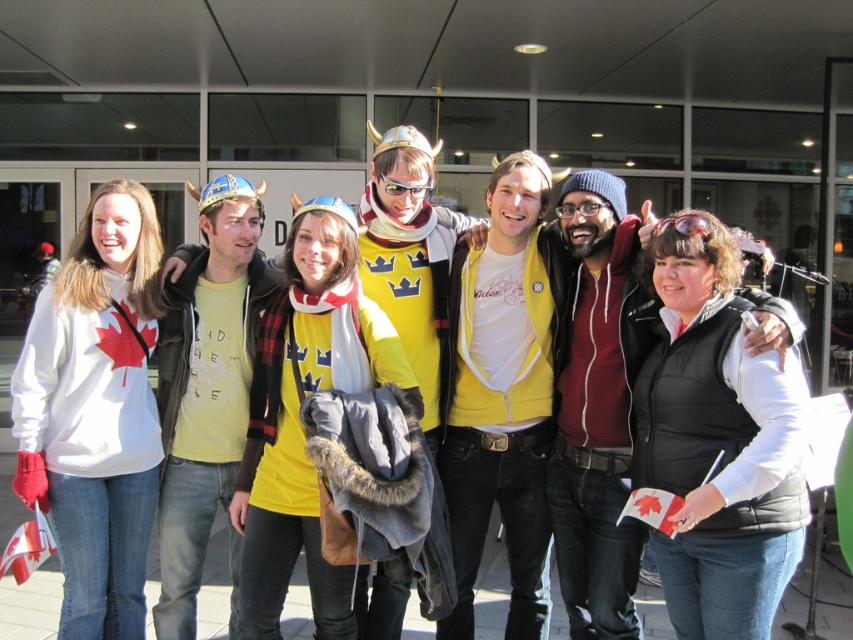
Question: Which point is closer to the camera?

Choices:
 (A) yellow matte shirt at center
 (B) matte black jacket at center
 (C) yellow t-shirt at center

Answer: (B)

Question: Which point appears closest to the camera in this image?

Choices:
 (A) (526, 406)
 (B) (418, 356)
 (C) (627, 371)
 (D) (195, 563)

Answer: (C)

Question: Is yellow zip-up hoodie at center to the right of matte black jacket at center from the viewer's perspective?

Choices:
 (A) yes
 (B) no

Answer: (B)

Question: Can you confirm if yellow zip-up hoodie at center is positioned below yellow t-shirt at center?

Choices:
 (A) no
 (B) yes

Answer: (A)

Question: Can you confirm if yellow zip-up hoodie at center is positioned to the right of yellow t-shirt at center?

Choices:
 (A) yes
 (B) no

Answer: (A)

Question: Which object is farther from the camera taking this photo?

Choices:
 (A) yellow t-shirt at center
 (B) matte black jacket at center
 (C) yellow matte shirt at center

Answer: (A)